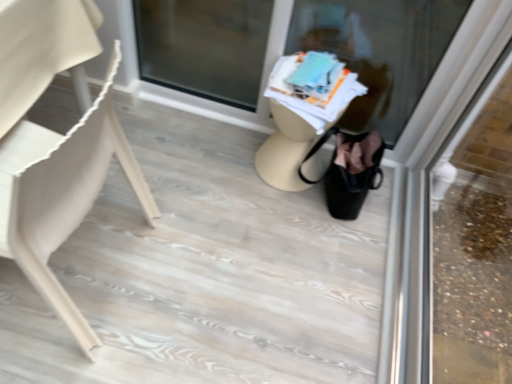
Question: Can you confirm if matte beige chair at left is positioned to the left of transparent glass door at upper right, marked as the first shop window in a right-to-left arrangement?

Choices:
 (A) no
 (B) yes

Answer: (B)

Question: From a real-world perspective, is matte beige chair at left physically above transparent glass door at upper right, marked as the first shop window in a right-to-left arrangement?

Choices:
 (A) yes
 (B) no

Answer: (B)

Question: Is matte beige chair at left facing towards transparent glass door at upper right, marked as the first shop window in a right-to-left arrangement?

Choices:
 (A) yes
 (B) no

Answer: (B)

Question: Does matte beige chair at left lie in front of transparent glass door at upper right, marked as the first shop window in a right-to-left arrangement?

Choices:
 (A) no
 (B) yes

Answer: (A)

Question: From the image's perspective, is matte beige chair at left below transparent glass door at upper right, marked as the first shop window in a right-to-left arrangement?

Choices:
 (A) yes
 (B) no

Answer: (B)

Question: Is matte beige chair at left bigger than transparent glass door at upper right, marked as the first shop window in a right-to-left arrangement?

Choices:
 (A) yes
 (B) no

Answer: (A)

Question: Is the depth of transparent glass door at upper right, the 2th shop window from the left, greater than that of translucent glass at center, the first shop window viewed from the left?

Choices:
 (A) no
 (B) yes

Answer: (A)

Question: Does transparent glass door at upper right, the 2th shop window from the left, have a smaller size compared to translucent glass at center, the first shop window viewed from the left?

Choices:
 (A) yes
 (B) no

Answer: (A)

Question: Is transparent glass door at upper right, marked as the first shop window in a right-to-left arrangement, far away from translucent glass at center, the first shop window viewed from the left?

Choices:
 (A) no
 (B) yes

Answer: (A)

Question: Can you confirm if transparent glass door at upper right, marked as the first shop window in a right-to-left arrangement, is shorter than translucent glass at center, the first shop window viewed from the left?

Choices:
 (A) no
 (B) yes

Answer: (B)

Question: Is transparent glass door at upper right, the 2th shop window from the left, outside translucent glass at center, the first shop window viewed from the left?

Choices:
 (A) yes
 (B) no

Answer: (A)

Question: From the image's perspective, is transparent glass door at upper right, marked as the first shop window in a right-to-left arrangement, above translucent glass at center, the first shop window viewed from the left?

Choices:
 (A) no
 (B) yes

Answer: (A)

Question: Does translucent glass at center, the 2th shop window in the right-to-left sequence, have a greater width compared to beige matte table at center?

Choices:
 (A) no
 (B) yes

Answer: (A)